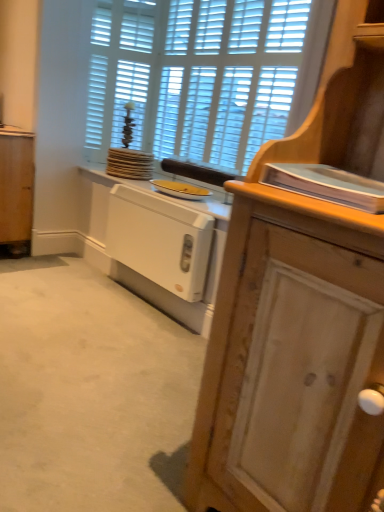
Question: Would you say white painted wood radiator at lower center, which appears as the second cabinetry when viewed from the left, is to the left or to the right of wooden cabinet at right, the 1th cabinetry in the right-to-left sequence, in the picture?

Choices:
 (A) left
 (B) right

Answer: (A)

Question: Based on their sizes in the image, would you say white painted wood radiator at lower center, placed as the second cabinetry when sorted from back to front, is bigger or smaller than wooden cabinet at right, the 1th cabinetry in the right-to-left sequence?

Choices:
 (A) small
 (B) big

Answer: (A)

Question: Which object is positioned farthest from the yellow matte plate at center?

Choices:
 (A) wooden cabinet at right, the 1th cabinetry in the right-to-left sequence
 (B) wooden cabinet at right
 (C) white painted wood radiator at lower center, which appears as the second cabinetry when viewed from the left
 (D) white wooden shutters at upper center
 (E) white plastic radiator at center

Answer: (A)

Question: Which is farther from the wooden cabinet at left, the first cabinetry viewed from the left?

Choices:
 (A) wooden cabinet at right, the 3th cabinetry positioned from the left
 (B) wooden cabinet at right
 (C) white painted wood radiator at lower center, placed as the second cabinetry when sorted from back to front
 (D) white plastic radiator at center
 (E) white wooden shutters at upper center

Answer: (A)